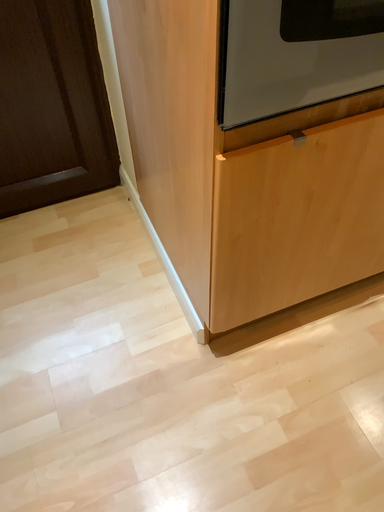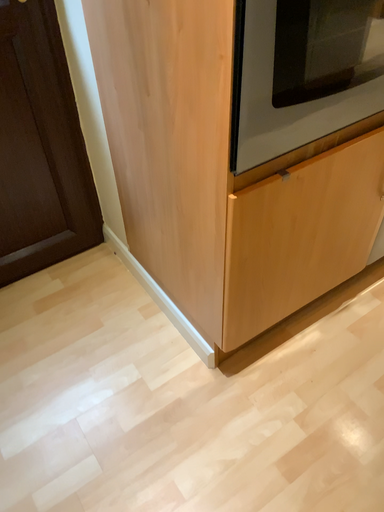
Question: How did the camera likely rotate when shooting the video?

Choices:
 (A) rotated upward
 (B) rotated downward

Answer: (A)